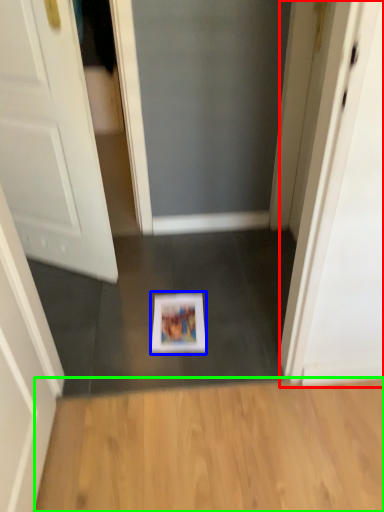
Question: Based on their relative distances, which object is nearer to screen door (highlighted by a red box)? Choose from magazine (highlighted by a blue box) and hardwood (highlighted by a green box).

Choices:
 (A) magazine
 (B) hardwood

Answer: (B)